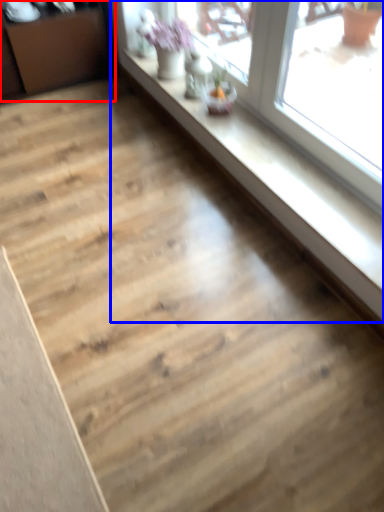
Question: Which of the following is the farthest to the observer, dresser (highlighted by a red box) or window (highlighted by a blue box)?

Choices:
 (A) dresser
 (B) window

Answer: (A)